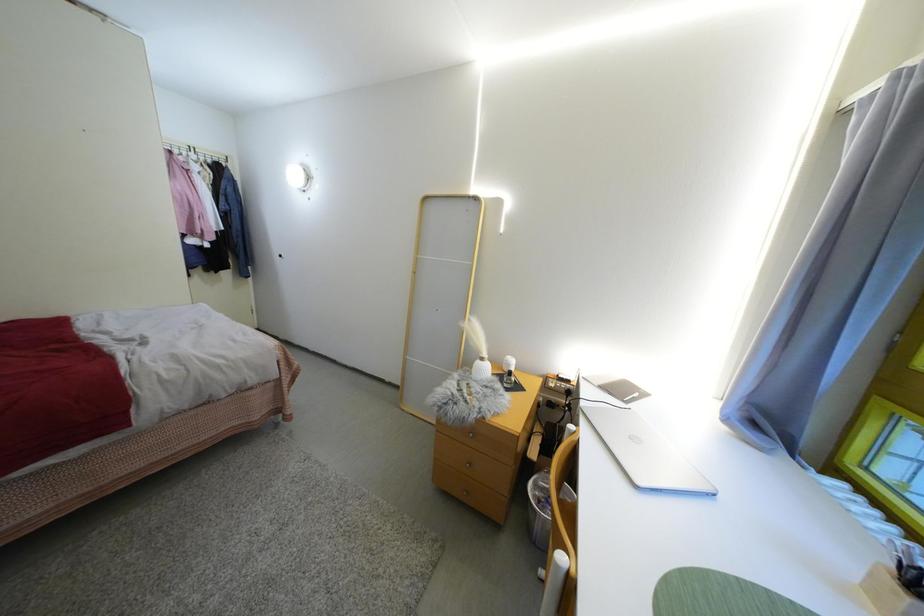
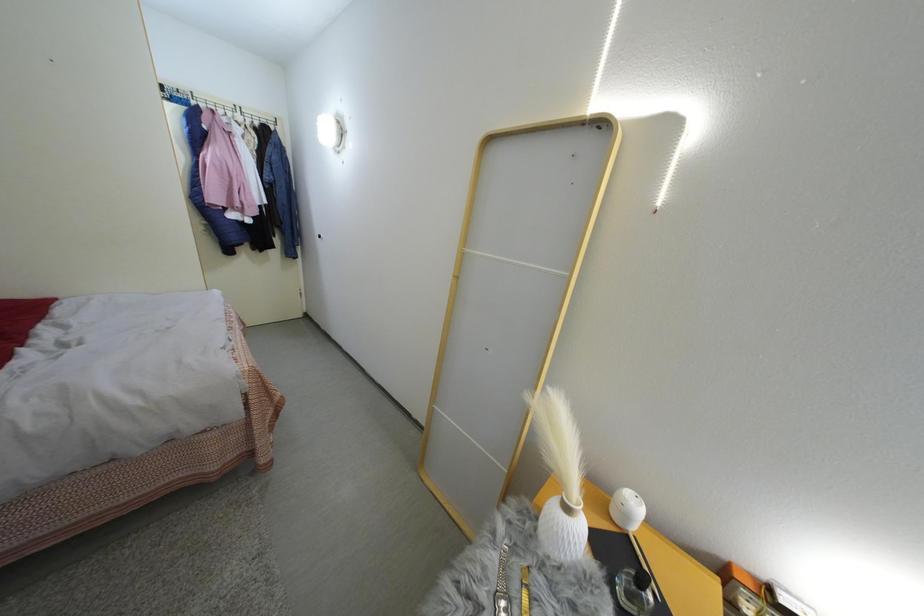
Question: The images are taken continuously from a first-person perspective. In which direction are you moving?

Choices:
 (A) Left
 (B) Right
 (C) Forward
 (D) Backward

Answer: (C)